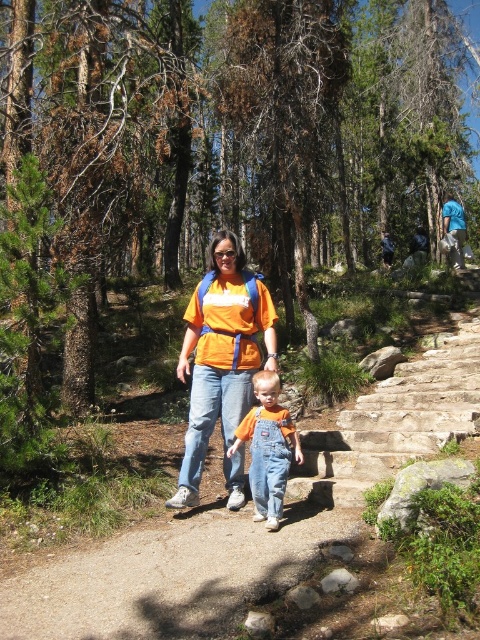
Question: Can you confirm if orange t-shirt at center is thinner than orange cotton shirt at center?

Choices:
 (A) yes
 (B) no

Answer: (B)

Question: Which object is farther from the camera taking this photo?

Choices:
 (A) orange cotton shirt at center
 (B) orange t-shirt at center
 (C) smooth concrete path at center

Answer: (B)

Question: Which of the following is the closest to the observer?

Choices:
 (A) (418, 394)
 (B) (250, 326)

Answer: (B)

Question: Which object is the farthest from the smooth concrete path at center?

Choices:
 (A) orange cotton shirt at center
 (B) orange t-shirt at center

Answer: (B)

Question: Is orange t-shirt at center to the right of orange cotton shirt at center from the viewer's perspective?

Choices:
 (A) no
 (B) yes

Answer: (A)

Question: Is smooth concrete path at center smaller than orange cotton shirt at center?

Choices:
 (A) yes
 (B) no

Answer: (B)